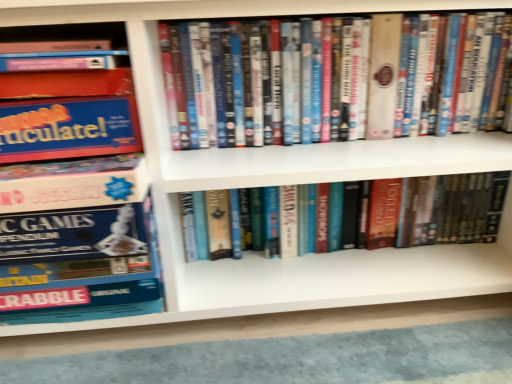
Question: Considering the relative positions of matte plastic dvds at center, marked as the second book in a right-to-left arrangement, and hardcover book at center, which is the first book in right-to-left order, in the image provided, is matte plastic dvds at center, marked as the second book in a right-to-left arrangement, to the left or to the right of hardcover book at center, which is the first book in right-to-left order,?

Choices:
 (A) right
 (B) left

Answer: (B)

Question: From a real-world perspective, is matte plastic dvds at center, placed as the 2th book when sorted from left to right, positioned above or below hardcover book at center, which is the first book in right-to-left order?

Choices:
 (A) above
 (B) below

Answer: (A)

Question: Which object is positioned closest to the matte plastic dvds at center, marked as the second book in a right-to-left arrangement?

Choices:
 (A) blue cardboard game box at left, the first book from the left
 (B) hardcover book at center, which is the first book in right-to-left order

Answer: (B)

Question: Which object is the closest to the matte plastic dvds at center, placed as the 2th book when sorted from left to right?

Choices:
 (A) hardcover book at center, the third book viewed from the left
 (B) blue cardboard game box at left, which is counted as the third book, starting from the right

Answer: (A)